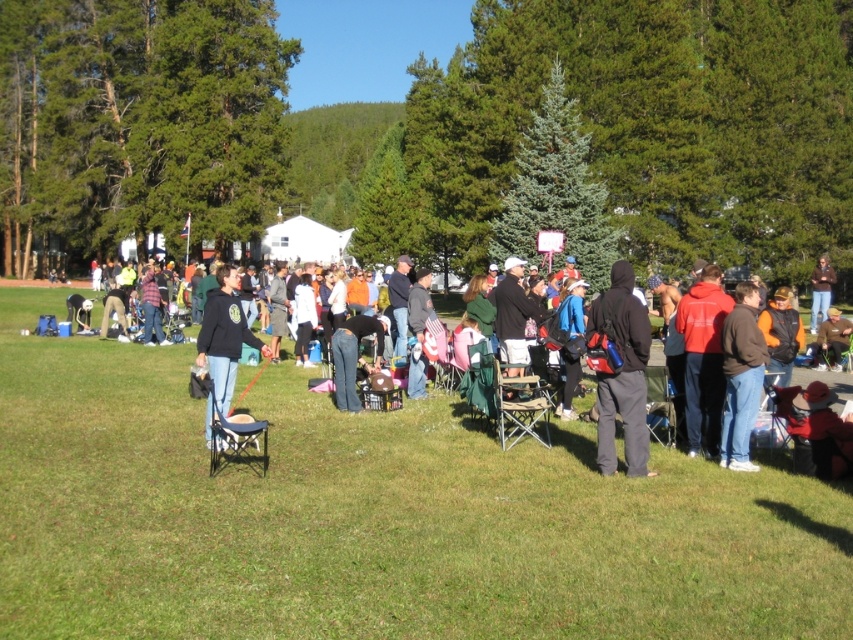
Can you confirm if matte black hoodie at center is wider than jeans at center?

In fact, matte black hoodie at center might be narrower than jeans at center.

Does matte black hoodie at center have a larger size compared to jeans at center?

Actually, matte black hoodie at center might be smaller than jeans at center.

Where is `matte black hoodie at center`? The image size is (853, 640). matte black hoodie at center is located at coordinates (619, 371).

Image resolution: width=853 pixels, height=640 pixels. What are the coordinates of `jeans at center` in the screenshot? It's located at (352, 356).

Between point (381, 340) and point (817, 288), which one is positioned behind?

Positioned behind is point (817, 288).

Is point (343, 353) positioned after point (817, 317)?

No, (343, 353) is closer to viewer.

Identify the location of jeans at center. (352, 356).

Who is shorter, green grass at center or black fleece jacket at center?

black fleece jacket at center is shorter.

Can you confirm if green grass at center is wider than black fleece jacket at center?

Yes.

Between point (192, 461) and point (236, 353), which one is positioned behind?

The point (236, 353) is behind.

Find the location of `green grass at center`. green grass at center is located at coordinates click(373, 516).